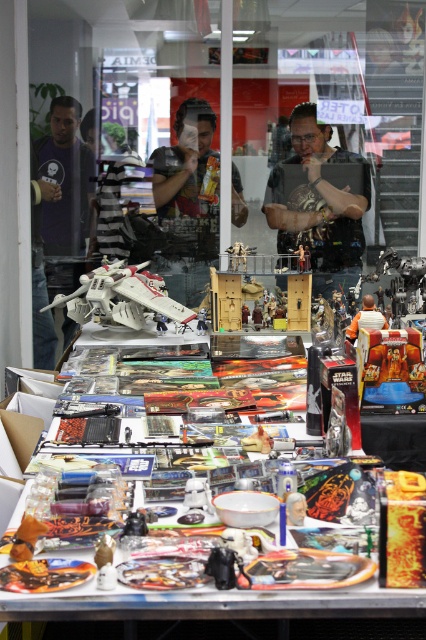
Question: Which object is closer to the camera taking this photo?

Choices:
 (A) matte black figure at center
 (B) matte black t-shirt at center
 (C) white plastic toy at center

Answer: (C)

Question: Which object appears farthest from the camera in this image?

Choices:
 (A) matte purple shirt at left
 (B) white plastic toy at center

Answer: (A)

Question: Can you confirm if metallic silver table at center is bigger than white plastic toy at center?

Choices:
 (A) yes
 (B) no

Answer: (B)

Question: Which of these objects is positioned farthest from the matte black figure at center?

Choices:
 (A) metallic silver table at center
 (B) matte black t-shirt at center

Answer: (A)

Question: Is matte purple shirt at left further to camera compared to white plastic toy at center?

Choices:
 (A) yes
 (B) no

Answer: (A)

Question: Is matte black figure at center bigger than matte purple shirt at left?

Choices:
 (A) no
 (B) yes

Answer: (B)